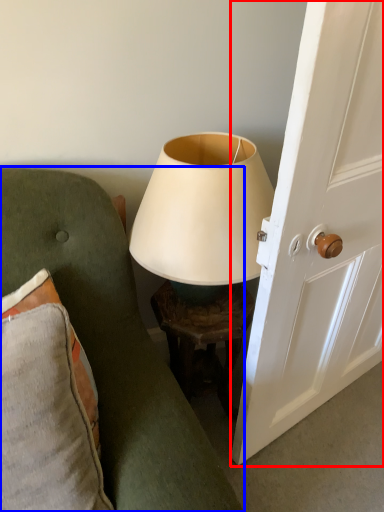
Question: Among these objects, which one is farthest to the camera, screen door (highlighted by a red box) or furniture (highlighted by a blue box)?

Choices:
 (A) screen door
 (B) furniture

Answer: (A)